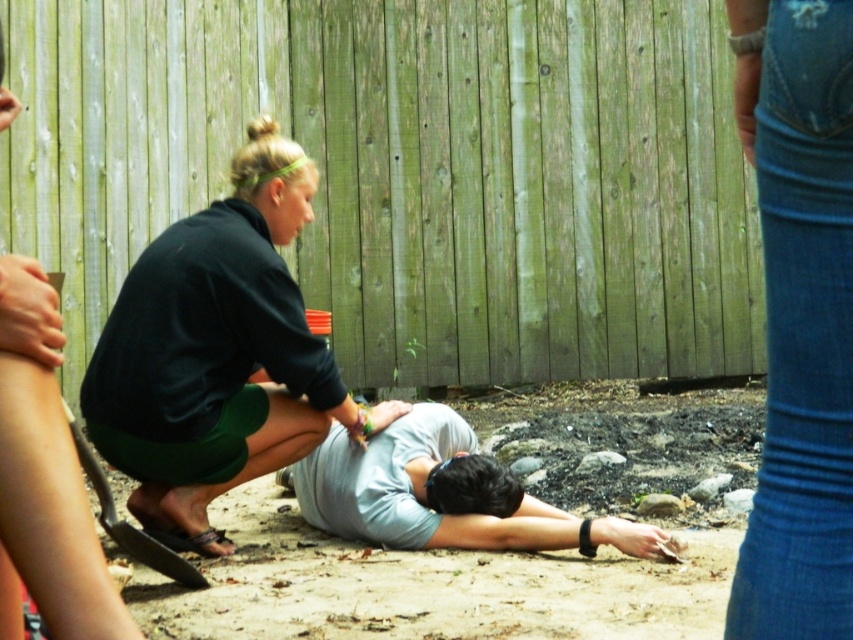
Between point (844, 531) and point (28, 344), which one is positioned behind?

Point (844, 531)

Is point (804, 330) less distant than point (55, 397)?

No, it is not.

Between point (759, 51) and point (96, 545), which one is positioned in front?

Point (96, 545) is in front.

At what (x,y) coordinates should I click in order to perform the action: click on denim jeans at lower right. Please return your answer as a coordinate pair (x, y). The width and height of the screenshot is (853, 640). Looking at the image, I should click on (799, 316).

Can you confirm if green wood fence at upper center is taller than dark green fabric shorts at lower left?

Yes, green wood fence at upper center is taller than dark green fabric shorts at lower left.

Who is more forward, [338,355] or [61,541]?

Point [61,541]

Which is in front, point (94, 172) or point (9, 516)?

Point (9, 516)

This screenshot has width=853, height=640. Identify the location of green wood fence at upper center. (410, 173).

Is dark green fabric skirt at center wider than denim jeans at lower right?

Yes, dark green fabric skirt at center is wider than denim jeans at lower right.

Describe the element at coordinates (218, 353) in the screenshot. I see `dark green fabric skirt at center` at that location.

Which is behind, point (236, 397) or point (846, 307)?

Positioned behind is point (236, 397).

Where is `dark green fabric skirt at center`? The image size is (853, 640). dark green fabric skirt at center is located at coordinates (218, 353).